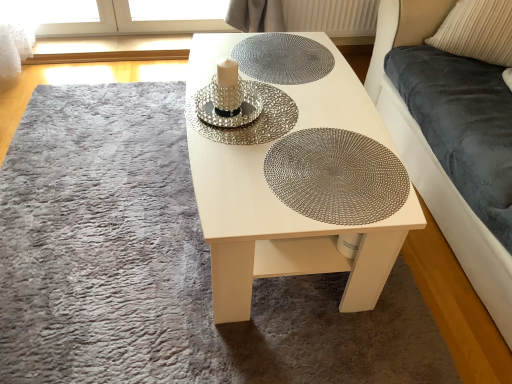
This screenshot has height=384, width=512. Find the location of `vacant space to the left of metallic woven placemat at center, marked as the 1th glass plate in a bottom-to-top arrangement`. vacant space to the left of metallic woven placemat at center, marked as the 1th glass plate in a bottom-to-top arrangement is located at coordinates (229, 180).